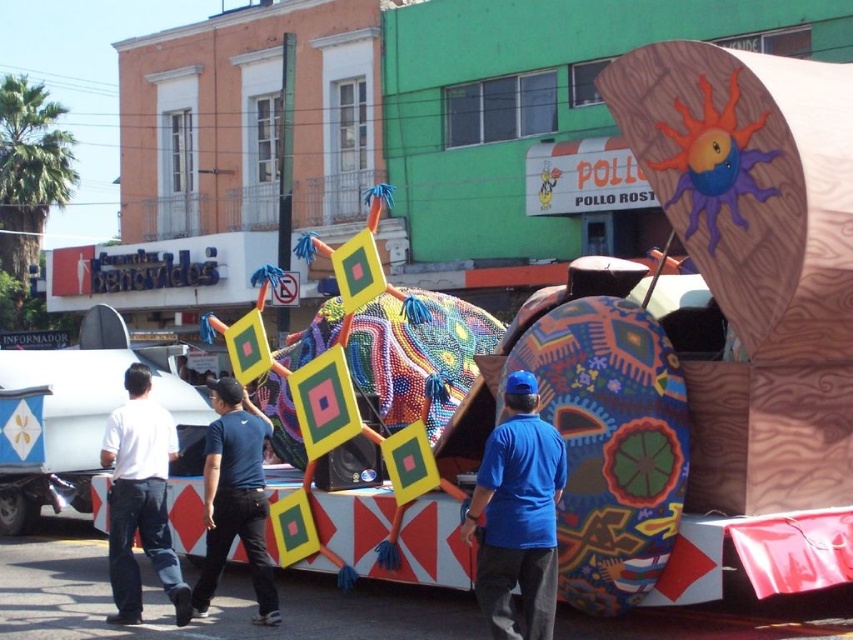
Question: Where is blue fabric shirt at center located in relation to white shirt at left in the image?

Choices:
 (A) below
 (B) above

Answer: (B)

Question: Which object is closer to the camera taking this photo?

Choices:
 (A) blue fabric shirt at center
 (B) blue cotton shirt at center
 (C) white shirt at left

Answer: (A)

Question: Which of the following is the closest to the observer?

Choices:
 (A) blue fabric shirt at center
 (B) blue cotton shirt at center
 (C) white shirt at left

Answer: (A)

Question: Can you confirm if blue fabric shirt at center is wider than blue cotton shirt at center?

Choices:
 (A) yes
 (B) no

Answer: (B)

Question: Does white shirt at left appear over blue cotton shirt at center?

Choices:
 (A) yes
 (B) no

Answer: (A)

Question: Which point is closer to the camera?

Choices:
 (A) (526, 445)
 (B) (112, 528)
 (C) (263, 438)

Answer: (A)